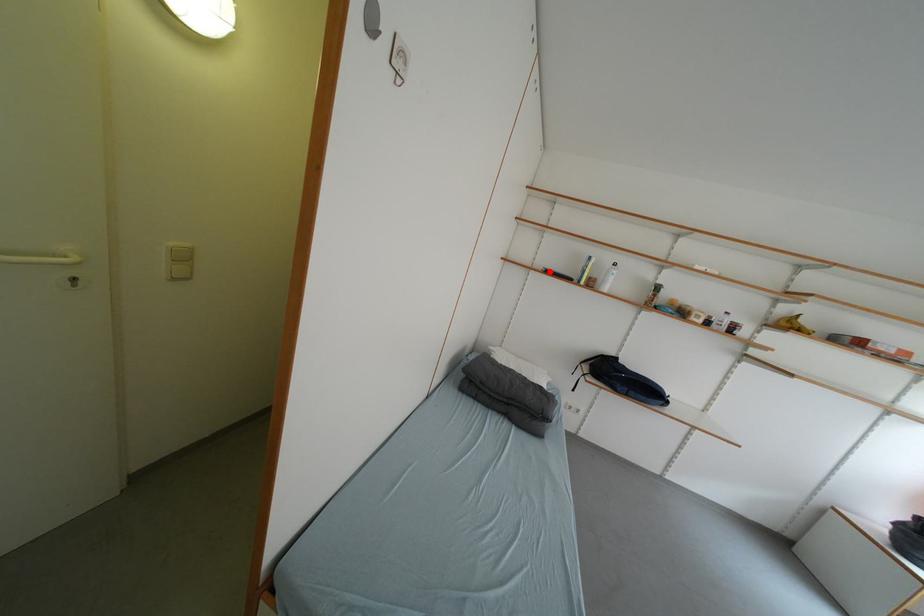
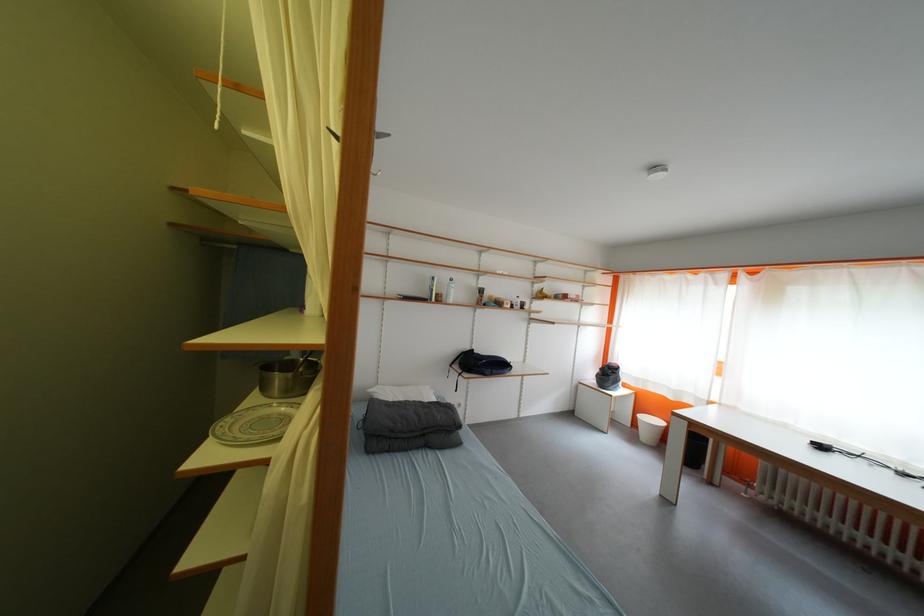
Locate, in the second image, the point that corresponds to the highlighted location in the first image.

(405, 299)